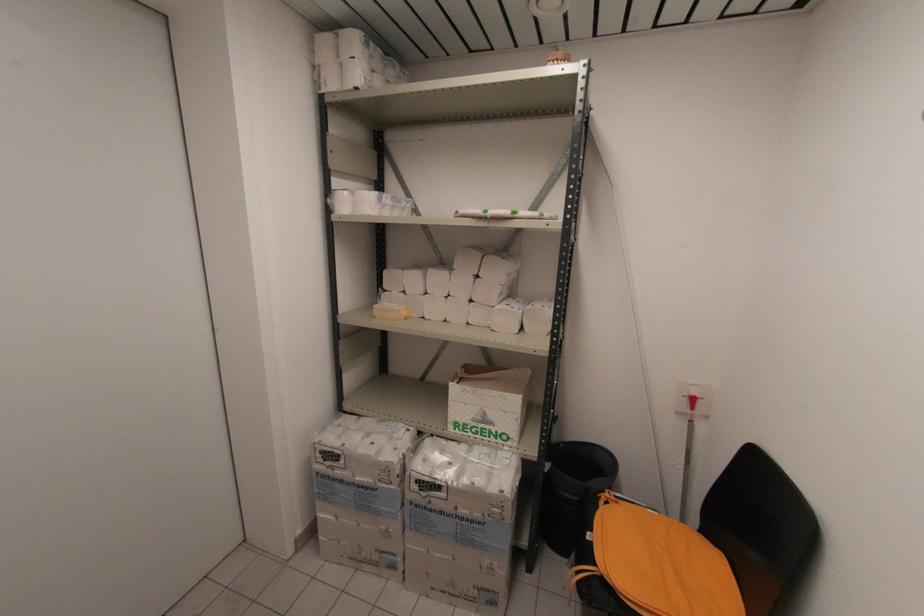
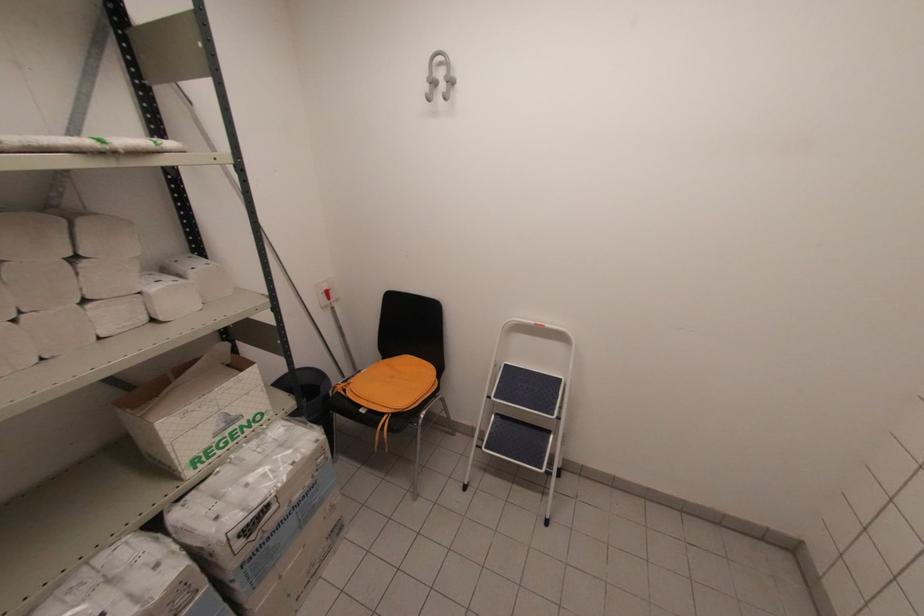
Locate, in the second image, the point that corresponds to (x=511, y=496) in the first image.

(325, 437)